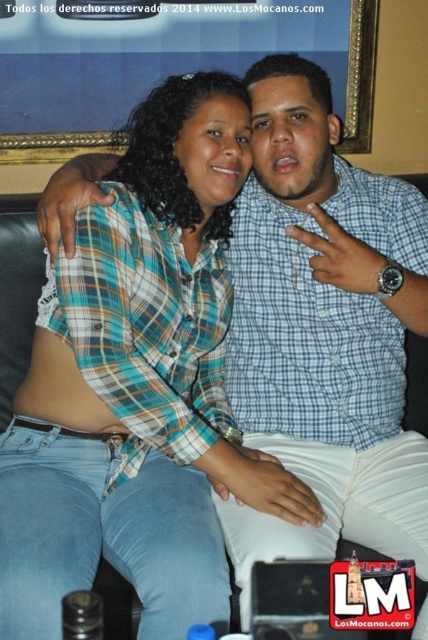
You are a photographer trying to capture a closeup of both the blue plaid shirt at center and the blue checkered shirt at center. Since you want to focus on the details of the plaid pattern, which shirt should you adjust your camera lens to focus on first?

The blue plaid shirt at center is shorter than the blue checkered shirt at center, so focusing on the blue plaid shirt at center first would ensure proper focus due to its closer proximity to the camera.

You are a photographer trying to capture a candid shot of the two people on the couch. You want to ensure that the person in the blue plaid shirt at center is framed to the left of the blue checkered shirt at center. Based on the scene, will this arrangement naturally occur in the image?

Yes, the blue plaid shirt at center is already positioned on the left side of the blue checkered shirt at center, so the desired framing will naturally occur in the image.